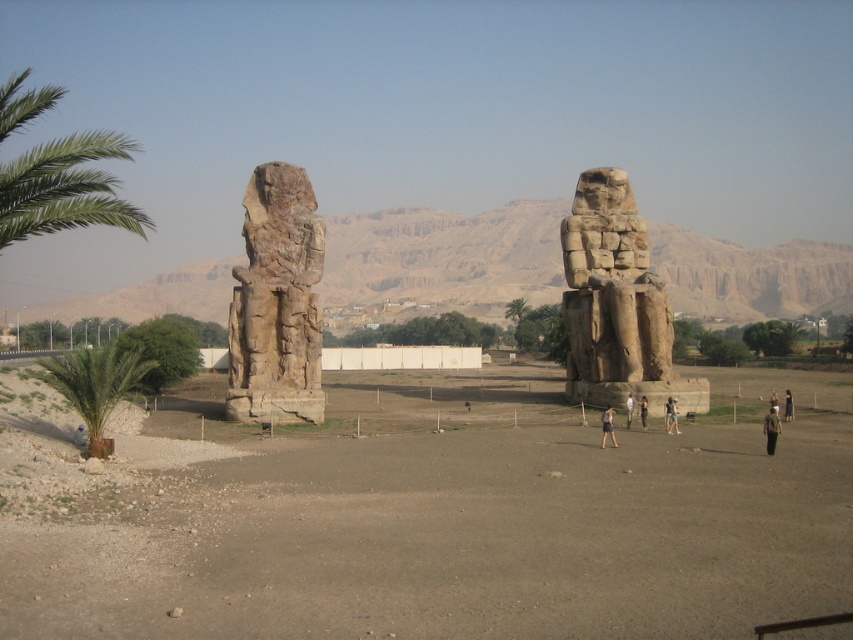
In the scene shown: Which is above, light brown fabric dress at center or brown fabric person at center?

light brown fabric dress at center is above.

At what (x,y) coordinates should I click in order to perform the action: click on light brown fabric dress at center. Please return your answer as a coordinate pair (x, y). Looking at the image, I should click on (671, 416).

Is rough stone statue at left wider than dark brown leather pants at center?

Correct, the width of rough stone statue at left exceeds that of dark brown leather pants at center.

Who is lower down, rough stone statue at left or dark brown leather pants at center?

dark brown leather pants at center is below.

What are the coordinates of `rough stone statue at left` in the screenshot? It's located at (276, 301).

Where is `rough stone statue at left`? The width and height of the screenshot is (853, 640). rough stone statue at left is located at coordinates (276, 301).

Who is taller, rough stone statue at left or brown fabric person at lower right?

Standing taller between the two is rough stone statue at left.

Who is more forward, (262, 204) or (766, 420)?

Point (766, 420) is in front.

This screenshot has width=853, height=640. I want to click on rough stone statue at left, so click(276, 301).